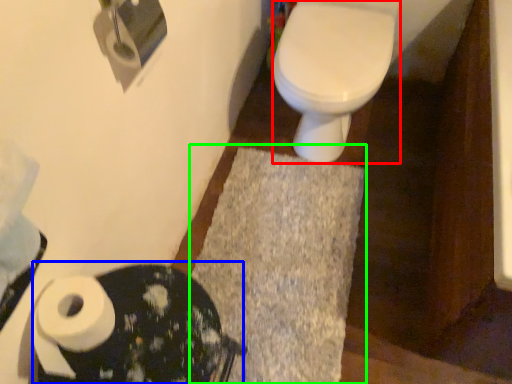
Question: Considering the real-world distances, which object is closest to bidet (highlighted by a red box)? porcelain (highlighted by a blue box) or bath mat (highlighted by a green box).

Choices:
 (A) porcelain
 (B) bath mat

Answer: (B)